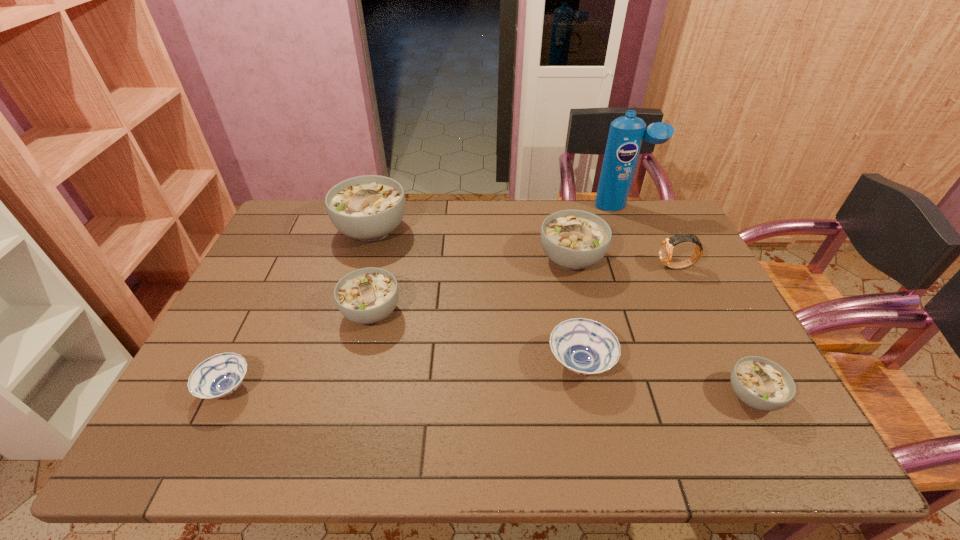
Image resolution: width=960 pixels, height=540 pixels. I want to click on the tallest object, so coord(626,133).

This screenshot has width=960, height=540. Identify the location of the tallest soup bowl. click(367, 208).

You are a GUI agent. You are given a task and a screenshot of the screen. Output one action in this format:
    pyautogui.click(x=<x>, y=<y>)
    Task: Click on the second tallest object
    Image resolution: width=960 pixels, height=540 pixels.
    Given the screenshot: What is the action you would take?
    pyautogui.click(x=367, y=208)

What are the coordinates of `the third white soup bowl from left to right` in the screenshot? It's located at (573, 239).

The image size is (960, 540). I want to click on the third smallest white soup bowl, so click(x=573, y=239).

Identify the location of watch. This screenshot has width=960, height=540. (666, 247).

Locate an element on the screen. The height and width of the screenshot is (540, 960). the fifth farthest object is located at coordinates (368, 295).

Locate an element on the screen. Image resolution: width=960 pixels, height=540 pixels. the third tallest soup bowl is located at coordinates (368, 295).

Where is `the right blue soup bowl`? Image resolution: width=960 pixels, height=540 pixels. the right blue soup bowl is located at coordinates (586, 347).

Locate an element on the screen. The height and width of the screenshot is (540, 960). the nearest white soup bowl is located at coordinates (760, 383).